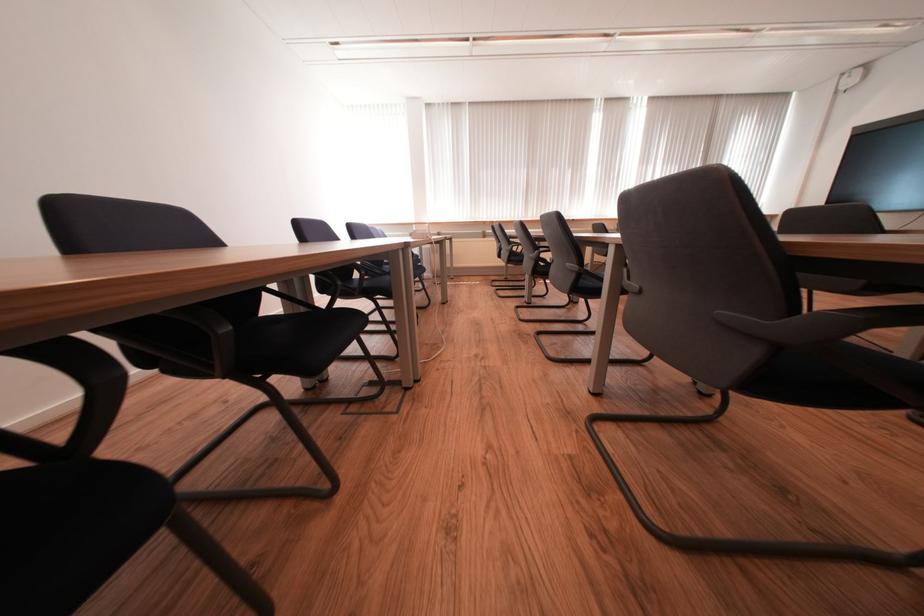
Identify the location of black chair sitting surface. The height and width of the screenshot is (616, 924). (322, 331).